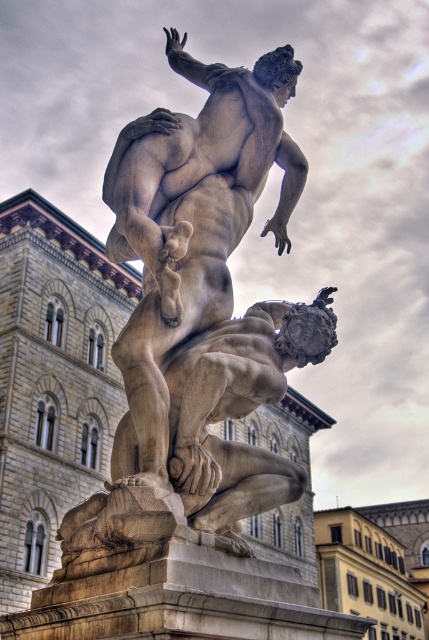
You are an art conservator examining the marble sculpture. You notice two points on the sculpture marked at coordinates point (242, 408) and point (175, 256). Which point is closer to you?

Point (242, 408) is further to the viewer than point (175, 256), so the point closer to you is point (175, 256).

You are an art student standing in front of the sculpture. You notice two statues at the center. Which one is closer to you, the white marble statue at center or the smooth stone statue at center?

The white marble statue at center is closer to the viewer than the smooth stone statue at center.

You are an art conservator tasked with moving the white marble statue at center and the smooth stone statue at center to a new exhibition space. The pathway between them is narrow. Can both statues be moved simultaneously through a doorway that is 3 meters wide without tilting them?

The white marble statue at center and the smooth stone statue at center are 2.75 meters apart. Since the doorway is 3 meters wide, the statues can be moved simultaneously through the doorway without tilting them as the combined width is less than the doorway width.